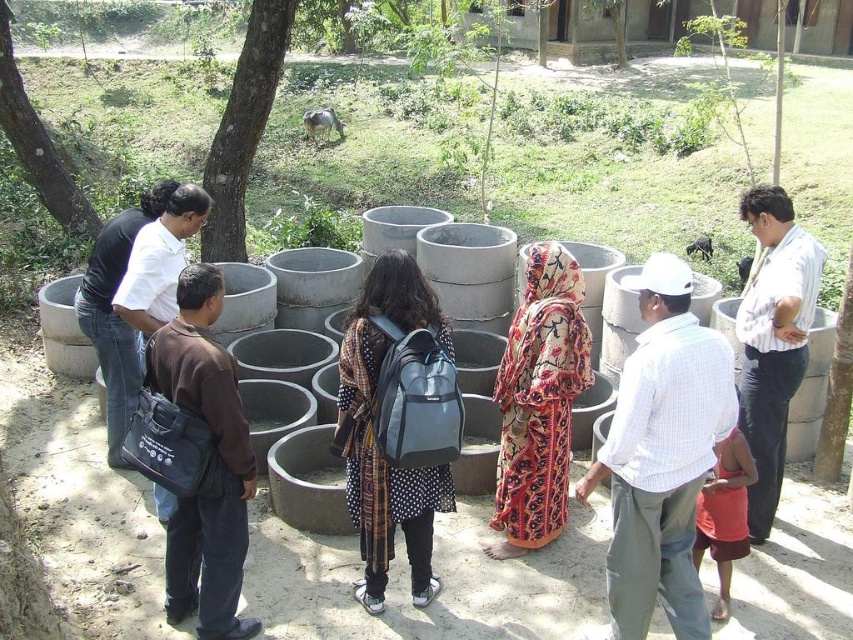
Question: Can you confirm if printed fabric dress at center is positioned above green rough bark tree at upper center?

Choices:
 (A) no
 (B) yes

Answer: (A)

Question: Considering the real-world distances, which object is closest to the green rough bark tree at upper center?

Choices:
 (A) printed fabric dress at center
 (B) green leafy tree at upper left
 (C) polka dot fabric dress at center

Answer: (B)

Question: Is printed fabric dress at center smaller than green leafy tree at upper left?

Choices:
 (A) no
 (B) yes

Answer: (A)

Question: Is printed fabric dress at center positioned in front of green leafy tree at upper left?

Choices:
 (A) no
 (B) yes

Answer: (B)

Question: Which object is farther from the camera taking this photo?

Choices:
 (A) polka dot fabric dress at center
 (B) green rough bark tree at upper center

Answer: (B)

Question: Which point appears farthest from the camera in this image?

Choices:
 (A) (444, 324)
 (B) (33, 172)

Answer: (B)